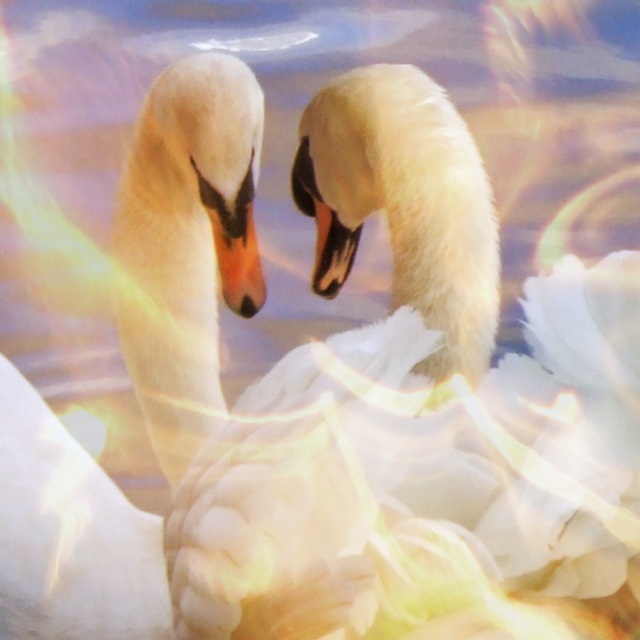
Question: Can you confirm if matte orange beak at center is positioned above black glossy beak at center?

Choices:
 (A) yes
 (B) no

Answer: (B)

Question: Which point is closer to the camera?

Choices:
 (A) (332, 211)
 (B) (225, 218)

Answer: (B)

Question: Considering the relative positions of matte orange beak at center and black glossy beak at center in the image provided, where is matte orange beak at center located with respect to black glossy beak at center?

Choices:
 (A) above
 (B) below

Answer: (B)

Question: Is matte orange beak at center positioned before black glossy beak at center?

Choices:
 (A) yes
 (B) no

Answer: (A)

Question: Which of the following is the farthest from the observer?

Choices:
 (A) (323, 268)
 (B) (250, 294)

Answer: (A)

Question: Which of the following is the closest to the observer?

Choices:
 (A) black glossy beak at center
 (B) matte orange beak at center

Answer: (B)